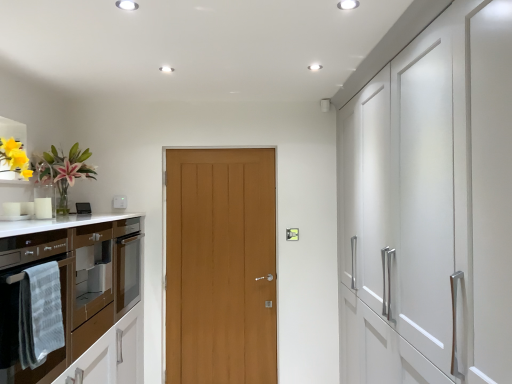
This screenshot has height=384, width=512. What do you see at coordinates (40, 314) in the screenshot?
I see `gray textured towel at left` at bounding box center [40, 314].

What do you see at coordinates (120, 202) in the screenshot?
I see `white plastic switch at upper center` at bounding box center [120, 202].

Find the location of a particular element. This screenshot has width=512, height=384. white plastic switch at upper center is located at coordinates (120, 202).

Image resolution: width=512 pixels, height=384 pixels. What do you see at coordinates (79, 295) in the screenshot?
I see `brown glossy oven at left` at bounding box center [79, 295].

Image resolution: width=512 pixels, height=384 pixels. What do you see at coordinates (212, 273) in the screenshot? I see `light brown wood door at center, which is counted as the first door, starting from the back` at bounding box center [212, 273].

What do you see at coordinates (221, 266) in the screenshot? I see `wooden door at center, the 2th door in the back-to-front sequence` at bounding box center [221, 266].

Find the location of `gray textured towel at left`. gray textured towel at left is located at coordinates (40, 314).

Can you confirm if brown glossy oven at left is wider than white plastic switch at upper center?

Yes, brown glossy oven at left is wider than white plastic switch at upper center.

In the scene shown: Do you think brown glossy oven at left is within white plastic switch at upper center, or outside of it?

The correct answer is: outside.

What's the angular difference between brown glossy oven at left and white plastic switch at upper center's facing directions?

They differ by 89.8 degrees in their facing directions.

From a real-world perspective, is brown glossy oven at left over white plastic switch at upper center?

No, from a real-world perspective, brown glossy oven at left is not on top of white plastic switch at upper center.

What's the angular difference between gray textured towel at left and white plastic switch at upper center's facing directions?

gray textured towel at left and white plastic switch at upper center are facing 91.1 degrees away from each other.

Considering the relative sizes of gray textured towel at left and white plastic switch at upper center in the image provided, is gray textured towel at left thinner than white plastic switch at upper center?

No.

Is gray textured towel at left oriented away from white plastic switch at upper center?

No.

Between gray textured towel at left and wooden door at center, the 1th door when ordered from front to back, which one has more height?

Standing taller between the two is wooden door at center, the 1th door when ordered from front to back.

From the picture: Is gray textured towel at left outside of wooden door at center, the 1th door when ordered from front to back?

Indeed, gray textured towel at left is completely outside wooden door at center, the 1th door when ordered from front to back.

Which object is wider, gray textured towel at left or wooden door at center, the 2th door in the back-to-front sequence?

wooden door at center, the 2th door in the back-to-front sequence.

Based on the photo, measure the distance from gray textured towel at left to wooden door at center, the 1th door when ordered from front to back.

A distance of 1.67 meters exists between gray textured towel at left and wooden door at center, the 1th door when ordered from front to back.

Is white plastic switch at upper center looking in the opposite direction of gray textured towel at left?

No, white plastic switch at upper center is not facing the opposite direction of gray textured towel at left.

Are white plastic switch at upper center and gray textured towel at left making contact?

white plastic switch at upper center is not next to gray textured towel at left, and they're not touching.

Can you confirm if white plastic switch at upper center is smaller than gray textured towel at left?

Indeed, white plastic switch at upper center has a smaller size compared to gray textured towel at left.

Is white plastic switch at upper center positioned beyond the bounds of gray textured towel at left?

white plastic switch at upper center is positioned outside gray textured towel at left.

From the image's perspective, is white plastic switch at upper center above light brown wood door at center, which is counted as the first door, starting from the back?

Indeed, from the image's perspective, white plastic switch at upper center is shown above light brown wood door at center, which is counted as the first door, starting from the back.

What's the angular difference between white plastic switch at upper center and light brown wood door at center, acting as the second door starting from the front,'s facing directions?

The facing directions of white plastic switch at upper center and light brown wood door at center, acting as the second door starting from the front, are 0.497 degrees apart.

Does white plastic switch at upper center appear on the left side of light brown wood door at center, which is counted as the first door, starting from the back?

Correct, you'll find white plastic switch at upper center to the left of light brown wood door at center, which is counted as the first door, starting from the back.

Between white plastic switch at upper center and light brown wood door at center, acting as the second door starting from the front, which one has smaller width?

Thinner between the two is light brown wood door at center, acting as the second door starting from the front.

Is white plastic switch at upper center positioned behind wooden door at center, the 2th door in the back-to-front sequence?

No, the depth of white plastic switch at upper center is less than that of wooden door at center, the 2th door in the back-to-front sequence.

Considering the relative sizes of white plastic switch at upper center and wooden door at center, the 1th door when ordered from front to back, in the image provided, is white plastic switch at upper center wider than wooden door at center, the 1th door when ordered from front to back,?

No, white plastic switch at upper center is not wider than wooden door at center, the 1th door when ordered from front to back.

Is white plastic switch at upper center facing away from wooden door at center, the 1th door when ordered from front to back?

white plastic switch at upper center is not turned away from wooden door at center, the 1th door when ordered from front to back.

Which of these two, brown glossy oven at left or wooden door at center, the 1th door when ordered from front to back, is bigger?

With larger size is brown glossy oven at left.

Is brown glossy oven at left in contact with wooden door at center, the 1th door when ordered from front to back?

No, brown glossy oven at left is not with wooden door at center, the 1th door when ordered from front to back.

Can you tell me how much brown glossy oven at left and wooden door at center, the 1th door when ordered from front to back, differ in facing direction?

brown glossy oven at left and wooden door at center, the 1th door when ordered from front to back, are facing 91 degrees away from each other.

Between brown glossy oven at left and wooden door at center, the 1th door when ordered from front to back, which one has smaller width?

With smaller width is wooden door at center, the 1th door when ordered from front to back.

Where is `appliance behind the brown glossy oven at left`? Image resolution: width=512 pixels, height=384 pixels. appliance behind the brown glossy oven at left is located at coordinates (120, 202).

At what (x,y) coordinates should I click in order to perform the action: click on appliance that is above the gray textured towel at left (from the image's perspective). Please return your answer as a coordinate pair (x, y). The image size is (512, 384). Looking at the image, I should click on (120, 202).

Looking at the image, which one is located further to brown glossy oven at left, gray textured towel at left or light brown wood door at center, which is counted as the first door, starting from the back?

Among the two, light brown wood door at center, which is counted as the first door, starting from the back, is located further to brown glossy oven at left.

Based on their spatial positions, is white plastic switch at upper center or wooden door at center, the 1th door when ordered from front to back, closer to gray textured towel at left?

The object closer to gray textured towel at left is white plastic switch at upper center.

Which object lies further to the anchor point white plastic switch at upper center, gray textured towel at left or wooden door at center, the 2th door in the back-to-front sequence?

gray textured towel at left.

Looking at this image, when comparing their distances from light brown wood door at center, acting as the second door starting from the front, does brown glossy oven at left or white plastic switch at upper center seem closer?

brown glossy oven at left is positioned closer to the anchor light brown wood door at center, acting as the second door starting from the front.

Which object lies further to the anchor point white plastic switch at upper center, wooden door at center, the 1th door when ordered from front to back, or brown glossy oven at left?

Among the two, brown glossy oven at left is located further to white plastic switch at upper center.

From the image, which object appears to be farther from light brown wood door at center, acting as the second door starting from the front, white plastic switch at upper center or gray textured towel at left?

Based on the image, gray textured towel at left appears to be further to light brown wood door at center, acting as the second door starting from the front.

Based on their spatial positions, is light brown wood door at center, acting as the second door starting from the front, or gray textured towel at left further from wooden door at center, the 2th door in the back-to-front sequence?

gray textured towel at left is further to wooden door at center, the 2th door in the back-to-front sequence.

From the image, which object appears to be farther from wooden door at center, the 1th door when ordered from front to back, gray textured towel at left or light brown wood door at center, acting as the second door starting from the front?

gray textured towel at left.

Identify the location of appliance positioned between brown glossy oven at left and light brown wood door at center, which is counted as the first door, starting from the back, from near to far. The height and width of the screenshot is (384, 512). click(x=120, y=202).

The height and width of the screenshot is (384, 512). Find the location of `door located between white plastic switch at upper center and light brown wood door at center, which is counted as the first door, starting from the back, in the left-right direction`. door located between white plastic switch at upper center and light brown wood door at center, which is counted as the first door, starting from the back, in the left-right direction is located at coordinates (221, 266).

You are a GUI agent. You are given a task and a screenshot of the screen. Output one action in this format:
    pyautogui.click(x=<x>, y=<y>)
    Task: Click on the door located between gray textured towel at left and light brown wood door at center, acting as the second door starting from the front, in the depth direction
    The height and width of the screenshot is (384, 512).
    Given the screenshot: What is the action you would take?
    pyautogui.click(x=221, y=266)

You are a GUI agent. You are given a task and a screenshot of the screen. Output one action in this format:
    pyautogui.click(x=<x>, y=<y>)
    Task: Click on the appliance positioned between gray textured towel at left and wooden door at center, the 2th door in the back-to-front sequence, from near to far
    The height and width of the screenshot is (384, 512).
    Given the screenshot: What is the action you would take?
    pyautogui.click(x=120, y=202)